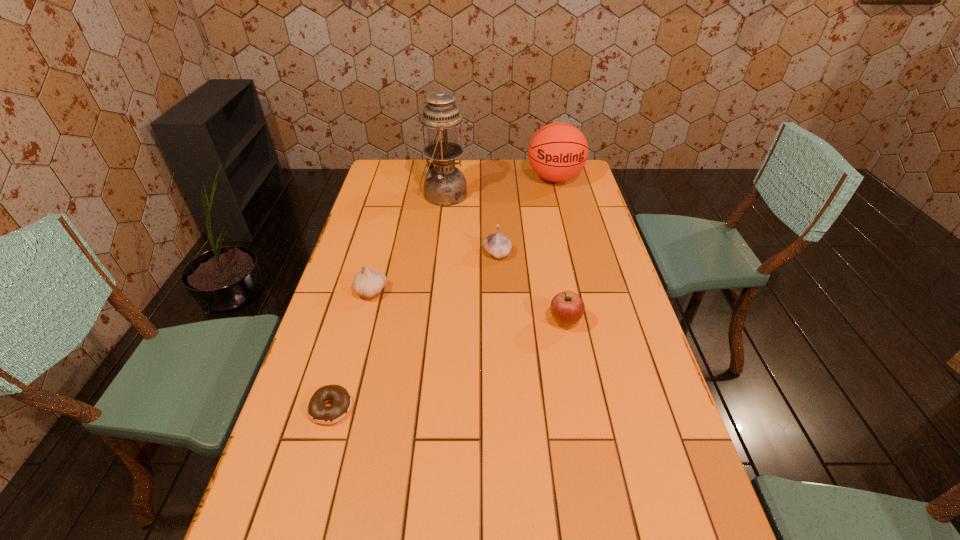
Find the location of a particular element. Image resolution: width=960 pixels, height=540 pixels. vacant space located on the right of the oil lamp is located at coordinates (519, 194).

Find the location of a particular element. The width and height of the screenshot is (960, 540). vacant space located 0.190m on the side with logo of the fifth shortest object is located at coordinates (564, 220).

Where is `free space located 0.170m on the front of the fourth nearest object`? The image size is (960, 540). free space located 0.170m on the front of the fourth nearest object is located at coordinates (499, 298).

Locate an element on the screen. The width and height of the screenshot is (960, 540). blank area located on the back of the second nearest object is located at coordinates (553, 259).

The image size is (960, 540). In order to click on vacant region located 0.150m on the back of the third nearest object in this screenshot , I will do `click(382, 251)`.

The height and width of the screenshot is (540, 960). What are the coordinates of `free space located on the back of the shortest object` in the screenshot? It's located at (353, 329).

Find the location of a particular element. oil lamp that is at the far edge is located at coordinates (445, 185).

Locate an element on the screen. basketball situated at the far edge is located at coordinates (558, 151).

Identify the location of garlic at the left edge. The image size is (960, 540). (368, 283).

Where is `doughnut that is at the left edge`? The width and height of the screenshot is (960, 540). doughnut that is at the left edge is located at coordinates (341, 399).